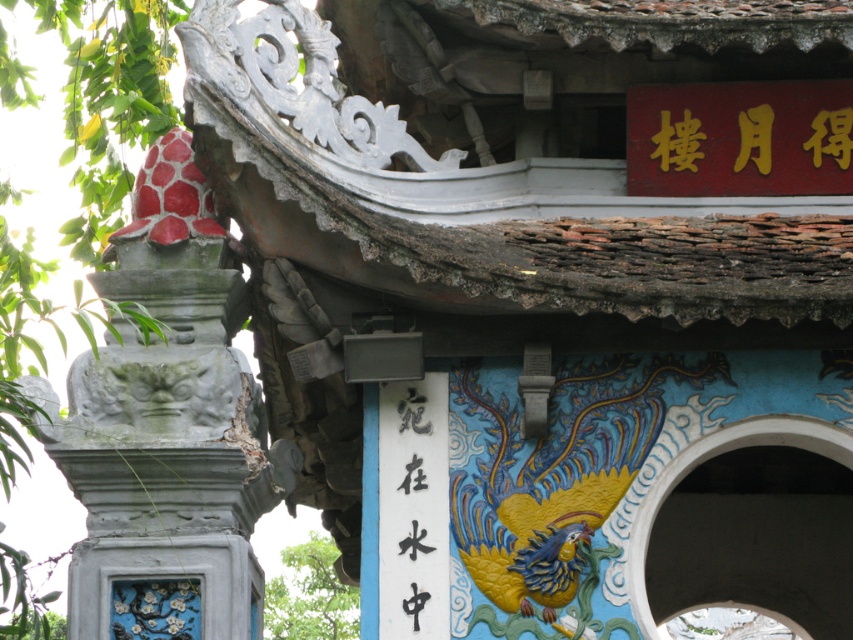
You are an architect examining the traditional East Asian structure. You notice the smooth gray stone pillar at left. Where is this pillar positioned relative to the ornate roofline?

The smooth gray stone pillar at left is located at point coordinates of 0.670 on the x axis and 0.197 on the y axis, which places it to the lower left area beneath the roofline.

You are standing in front of an ancient East Asian temple structure. You notice two points marked on the roof. The first point is at coordinate point(74, 364) and the second is at point(824, 422). From your perspective, which point is closer to you?

Point(74, 364) is in front of point(824, 422), so it is closer to you.